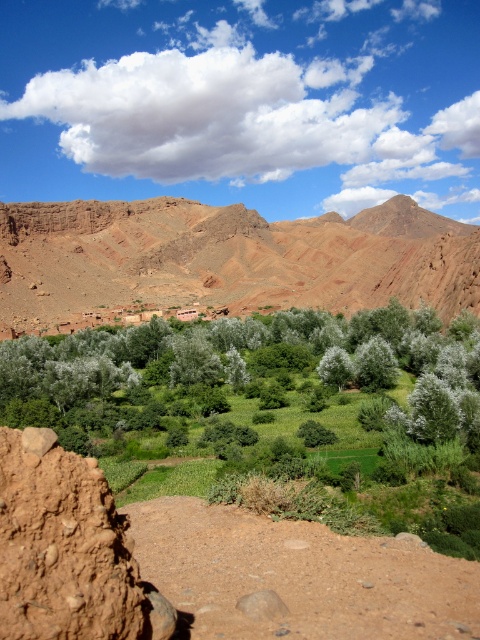
Measure the distance from brown rocky mountain at center to green leafy trees at center.

brown rocky mountain at center is 147.22 meters away from green leafy trees at center.

Who is positioned more to the right, brown rocky mountain at center or green leafy trees at center?

brown rocky mountain at center is more to the right.

Locate an element on the screen. The width and height of the screenshot is (480, 640). brown rocky mountain at center is located at coordinates (225, 259).